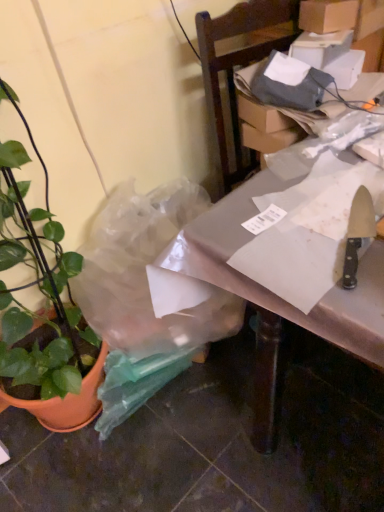
Image resolution: width=384 pixels, height=512 pixels. I want to click on vacant area on top of white paper at right (from a real-world perspective), so click(320, 203).